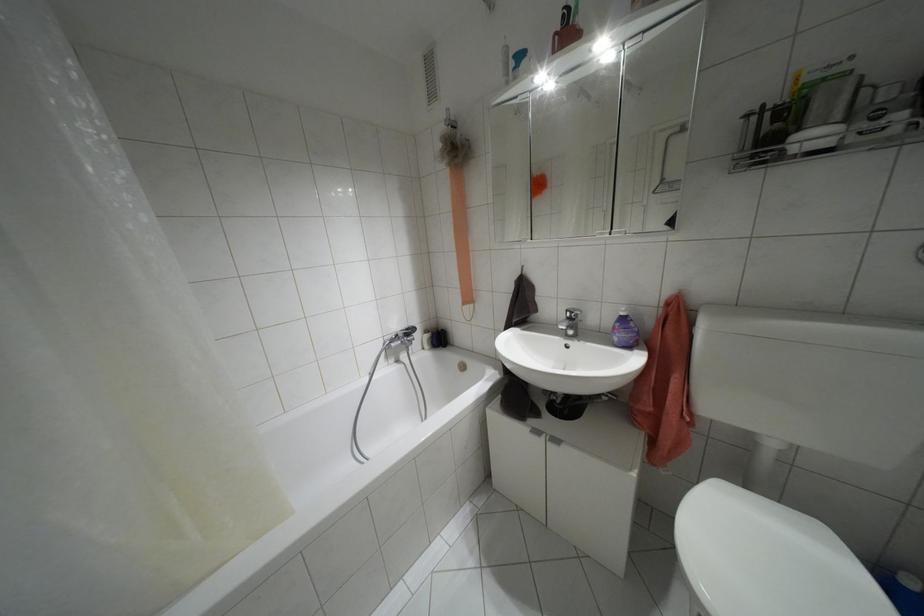
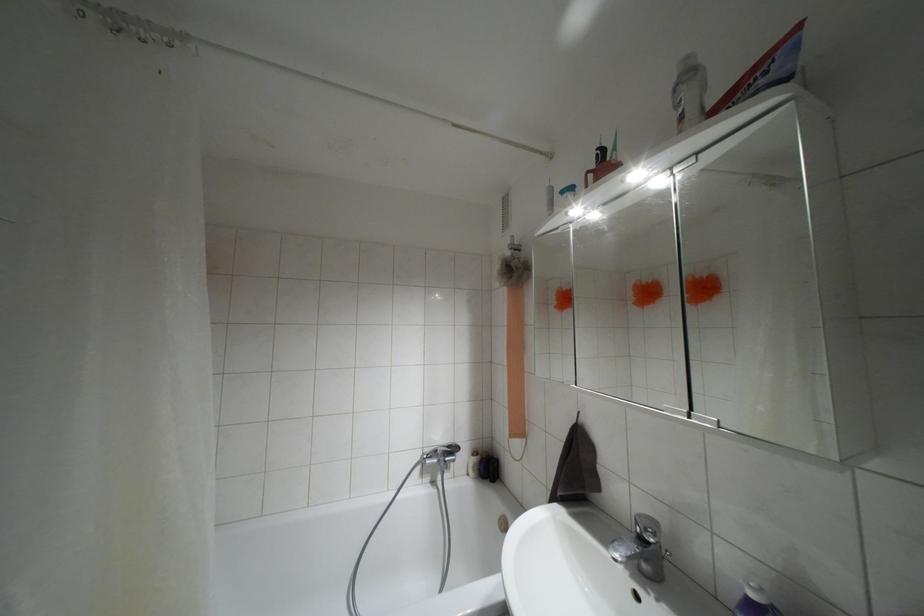
Locate, in the second image, the point that corresponds to (x=407, y=329) in the first image.

(447, 446)